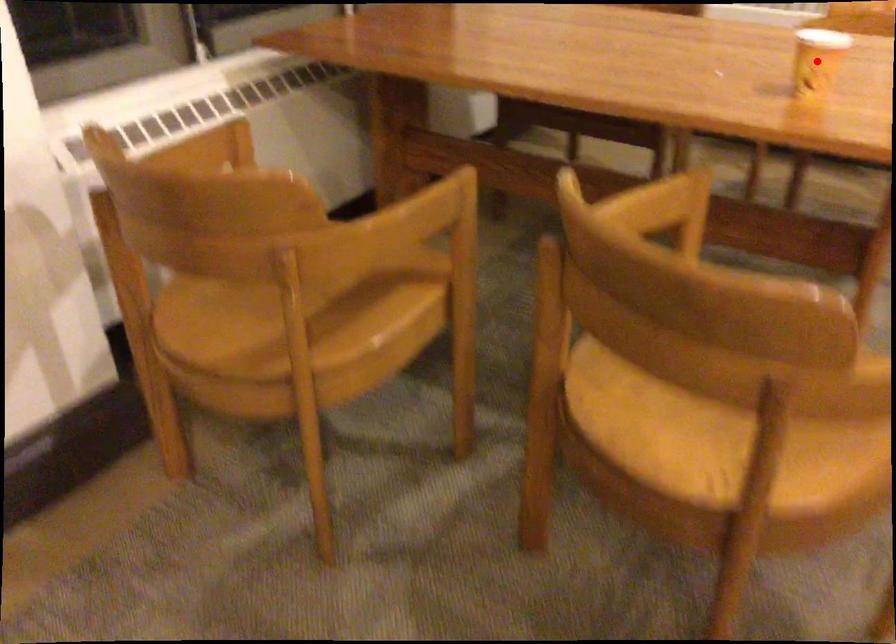
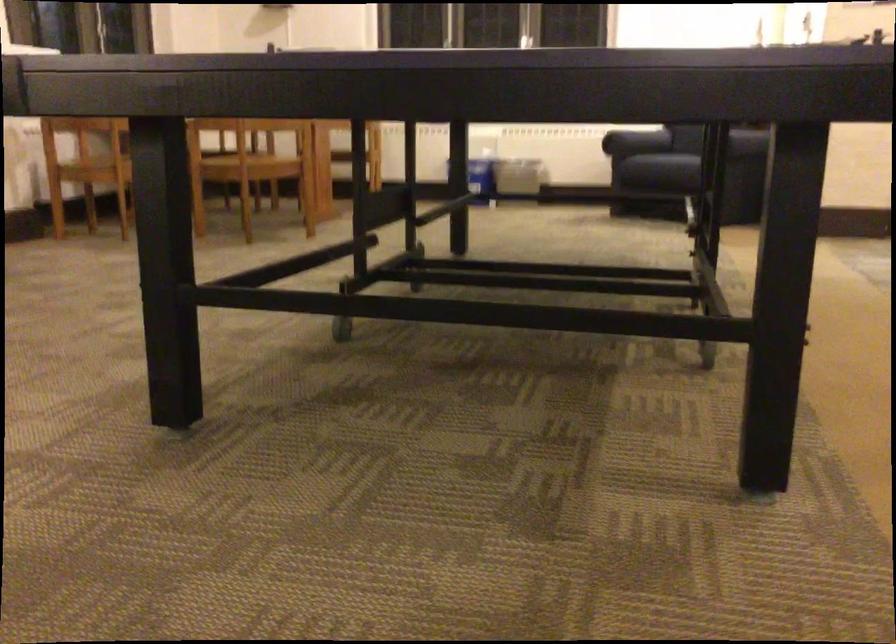
Question: I am providing you with two images of the same scene from different viewpoints. A red point is marked on the first image. At the location where the point appears in image 1, is it still visible in image 2?

Choices:
 (A) Yes
 (B) No

Answer: (B)